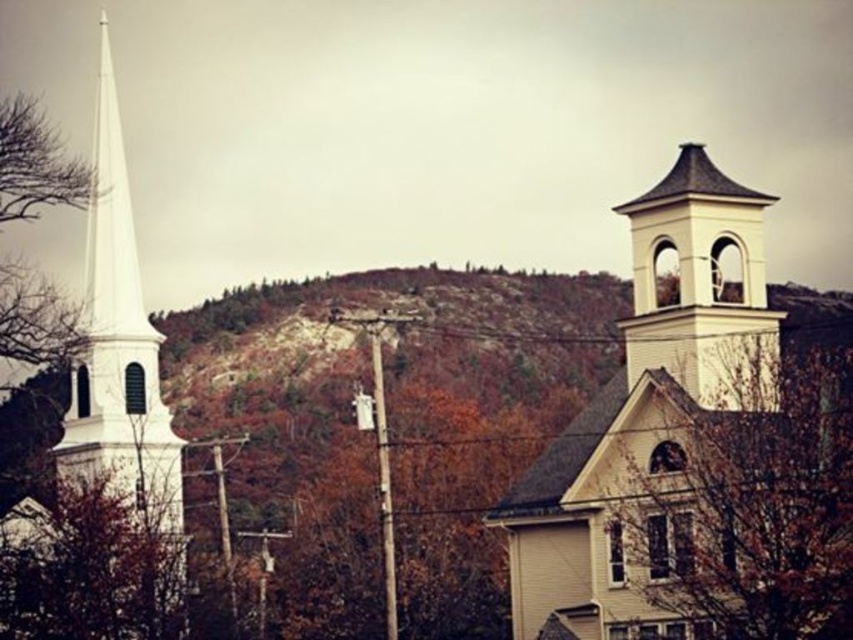
You are standing in the autumnal scene and want to determine which of the two points is closer to you. The points are located at point (113, 316) and point (772, 312). Which point is closer to your current position?

Point (113, 316) is further to the viewer than point (772, 312). Therefore, point (772, 312) is closer to your current position.